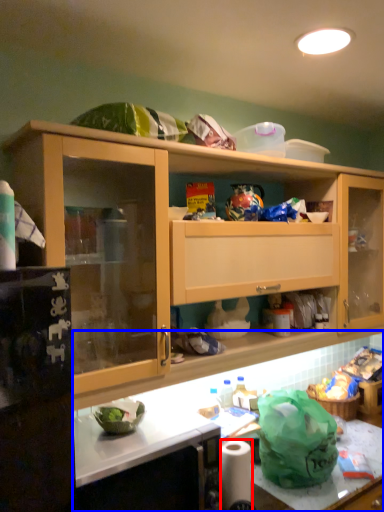
Question: Which point is closer to the camera, toilet paper (highlighted by a red box) or countertop (highlighted by a blue box)?

Choices:
 (A) toilet paper
 (B) countertop

Answer: (B)